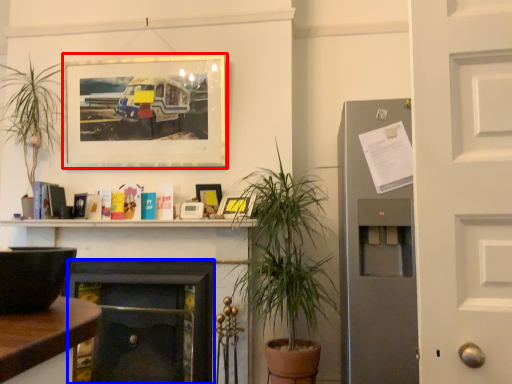
Question: Among these objects, which one is farthest to the camera, picture frame (highlighted by a red box) or fireplace (highlighted by a blue box)?

Choices:
 (A) picture frame
 (B) fireplace

Answer: (A)